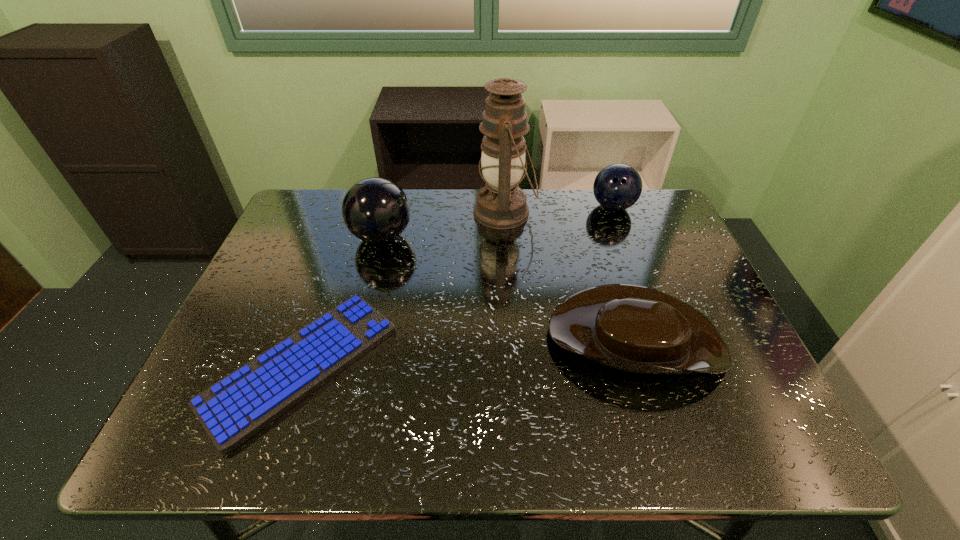
I want to click on blank area located 0.080m on the back of the cowboy hat, so click(x=612, y=266).

You are a GUI agent. You are given a task and a screenshot of the screen. Output one action in this format:
    pyautogui.click(x=<x>, y=<y>)
    Task: Click on the vacant area located on the right of the computer keyboard
    
    Given the screenshot: What is the action you would take?
    pyautogui.click(x=421, y=366)

Locate an element on the screen. This screenshot has height=540, width=960. oil lamp present at the far edge is located at coordinates (501, 204).

The height and width of the screenshot is (540, 960). What are the coordinates of `object that is at the near edge` in the screenshot? It's located at (235, 408).

Find the location of `object present at the left edge`. object present at the left edge is located at coordinates (235, 408).

Find the location of a particular element. The height and width of the screenshot is (540, 960). bowling ball situated at the right edge is located at coordinates (618, 186).

This screenshot has height=540, width=960. In order to click on cowboy hat that is at the right edge in this screenshot , I will do `click(631, 328)`.

Where is `object that is at the near left corner`? This screenshot has height=540, width=960. object that is at the near left corner is located at coordinates (235, 408).

Where is `object at the far right corner`? Image resolution: width=960 pixels, height=540 pixels. object at the far right corner is located at coordinates (618, 186).

Image resolution: width=960 pixels, height=540 pixels. In the image, there is a desktop. In order to click on vacant space at the far edge in this screenshot , I will do `click(604, 226)`.